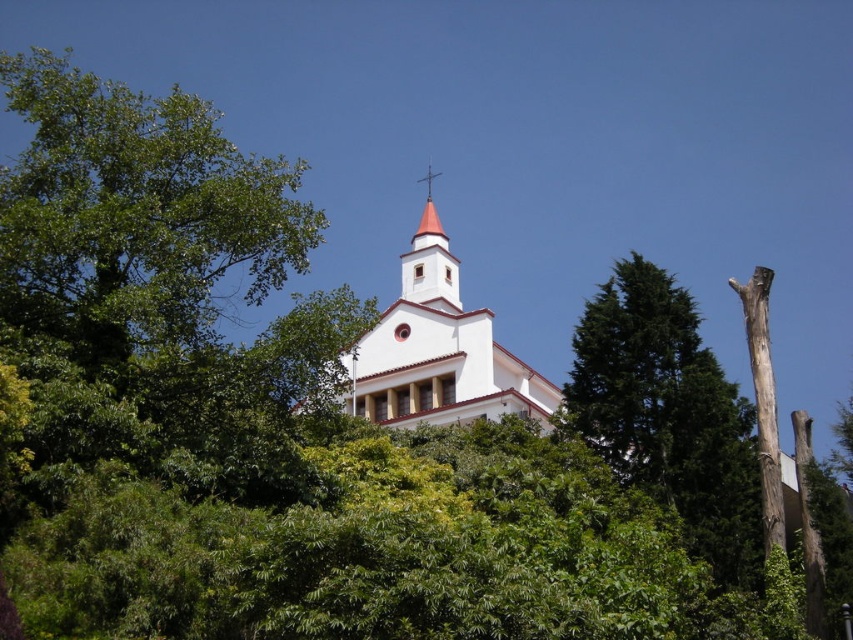
Does green textured tree at right appear on the left side of white stucco church at center?

In fact, green textured tree at right is to the right of white stucco church at center.

Which is behind, point (738, 561) or point (419, 358)?

The point (419, 358) is more distant.

You are a GUI agent. You are given a task and a screenshot of the screen. Output one action in this format:
    pyautogui.click(x=<x>, y=<y>)
    Task: Click on the green textured tree at right
    This screenshot has height=640, width=853.
    Given the screenshot: What is the action you would take?
    pyautogui.click(x=668, y=413)